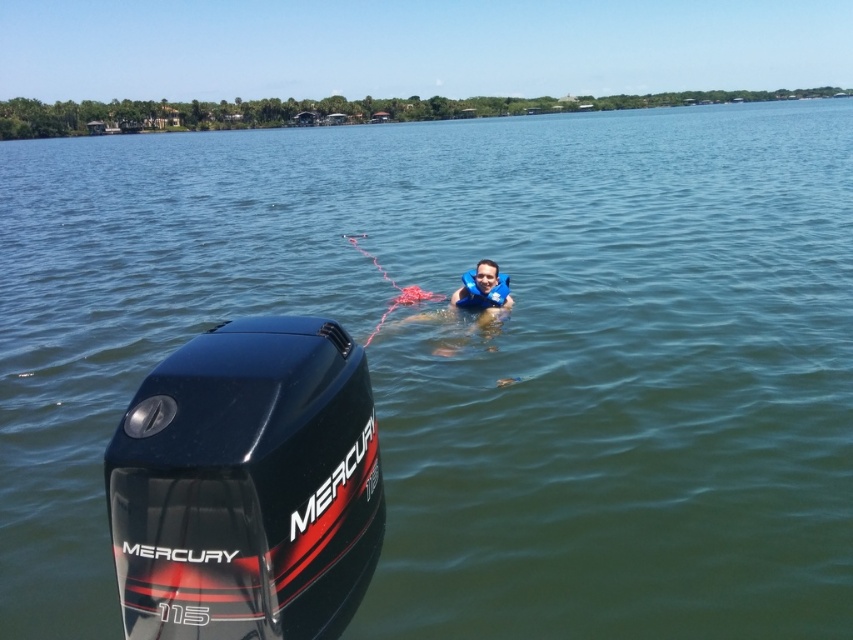
Looking at this image, you are operating a boat with a shiny black mercury outboard motor at lower left and notice a blue foam life jacket at center floating in the water. Can you safely retrieve the life jacket using a 5 meter long rope?

The shiny black mercury outboard motor at lower left is 6.23 meters away from the blue foam life jacket at center. Since the rope is only 5 meters long, it is not long enough to reach the life jacket.

What are the coordinates of the shiny black mercury outboard motor at lower left in the image?

The coordinates of the shiny black mercury outboard motor at lower left are at point [247,484].